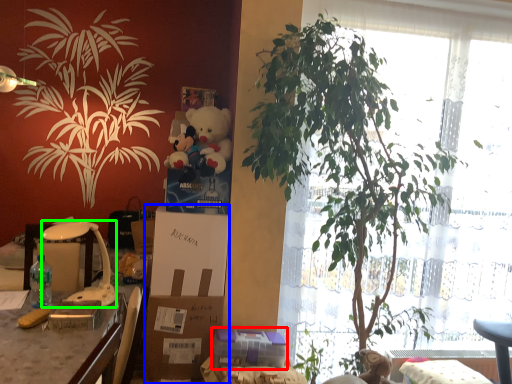
Question: Which object is positioned farthest from gift (highlighted by a red box)? Select from box (highlighted by a blue box) and lamp (highlighted by a green box).

Choices:
 (A) box
 (B) lamp

Answer: (B)